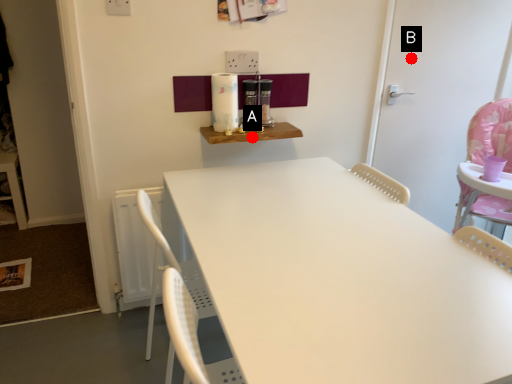
Question: Two points are circled on the image, labeled by A and B beside each circle. Which point appears farthest from the camera in this image?

Choices:
 (A) A is further
 (B) B is further

Answer: (B)